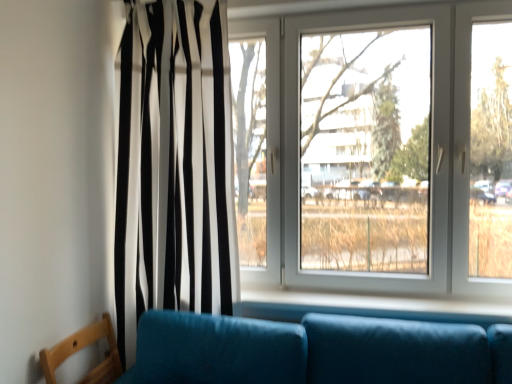
Image resolution: width=512 pixels, height=384 pixels. What are the coordinates of `free location above white plastic window at center (from a real-world perspective)` in the screenshot? It's located at (362, 6).